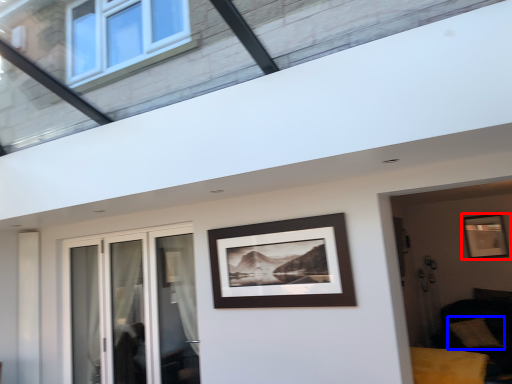
Question: Which point is further to the camera, picture frame (highlighted by a red box) or pillow (highlighted by a blue box)?

Choices:
 (A) picture frame
 (B) pillow

Answer: (A)